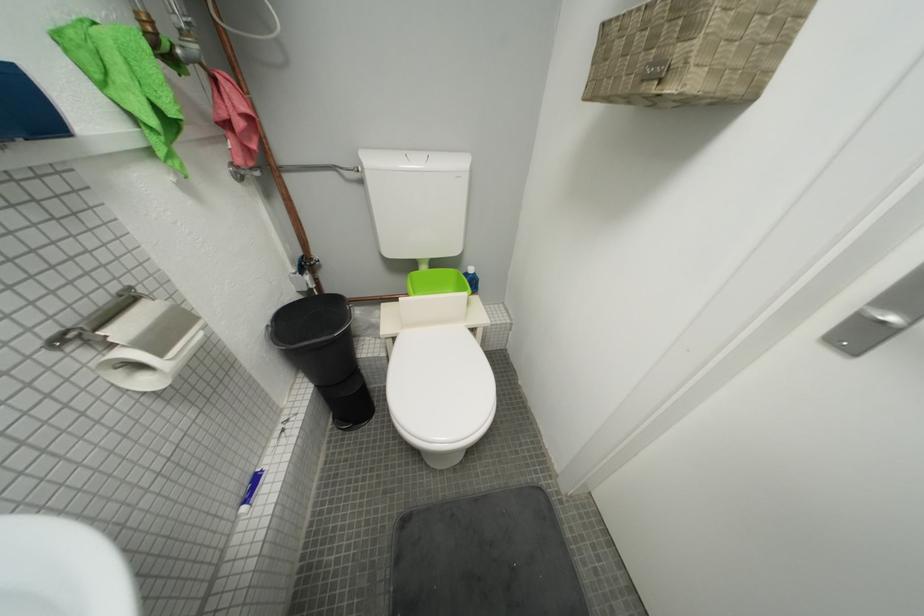
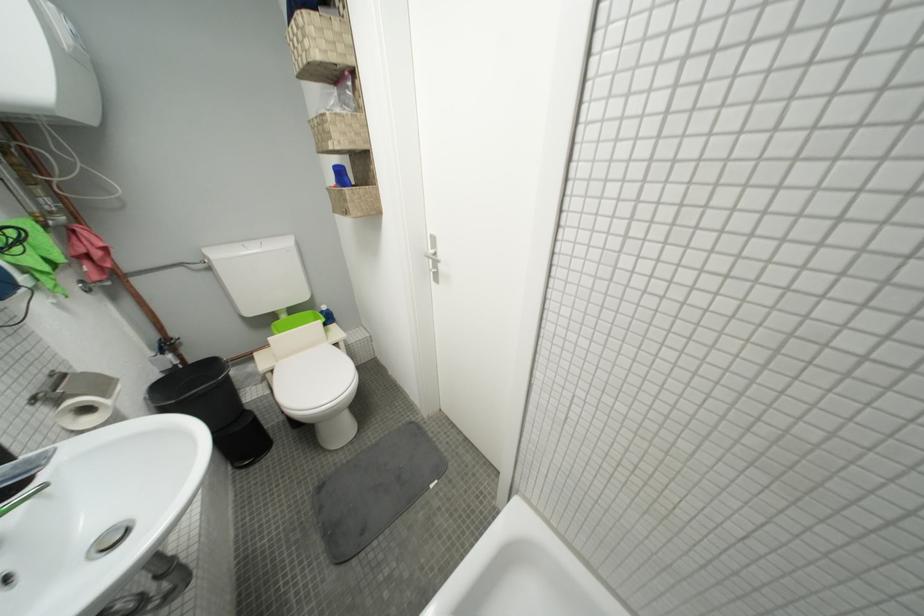
Locate, in the second image, the point that corresponds to (x=427, y=164) in the first image.

(262, 252)